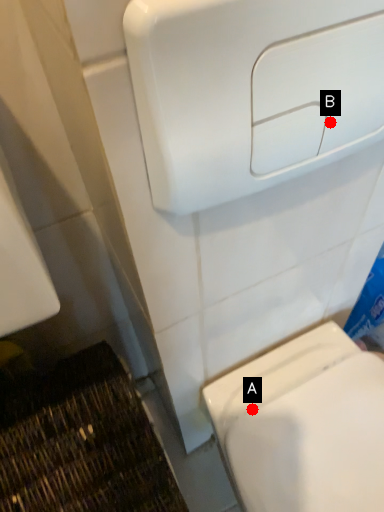
Question: Two points are circled on the image, labeled by A and B beside each circle. Which point is farther to the camera?

Choices:
 (A) A is further
 (B) B is further

Answer: (A)